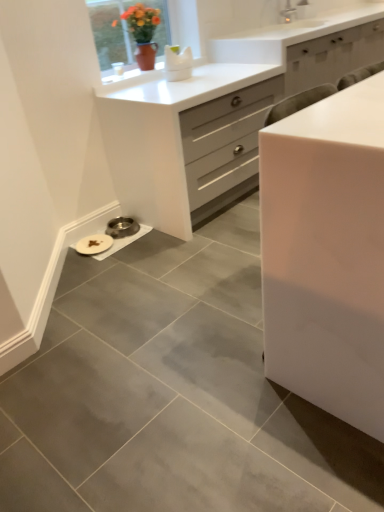
What do you see at coordinates (131, 34) in the screenshot? I see `matte ceramic vase at upper center` at bounding box center [131, 34].

The image size is (384, 512). I want to click on white glossy chest of drawers at center, placed as the second chest of drawers when sorted from front to back, so click(x=161, y=137).

Measure the distance between point (376, 95) and camera.

Point (376, 95) is 4.06 feet away from camera.

Where is `matte ceramic vase at upper center`? matte ceramic vase at upper center is located at coordinates (131, 34).

Which object is positioned more to the left, white glossy cabinet at center, marked as the first chest of drawers in a front-to-back arrangement, or white glossy chest of drawers at center, placed as the second chest of drawers when sorted from front to back?

From the viewer's perspective, white glossy chest of drawers at center, placed as the second chest of drawers when sorted from front to back, appears more on the left side.

At what (x,y) coordinates should I click in order to perform the action: click on chest of drawers above the white glossy chest of drawers at center, the first chest of drawers when ordered from back to front (from a real-world perspective). Please return your answer as a coordinate pair (x, y). Looking at the image, I should click on (326, 253).

How many degrees apart are the facing directions of white glossy cabinet at center, which is counted as the 2th chest of drawers, starting from the back, and white glossy chest of drawers at center, placed as the second chest of drawers when sorted from front to back?

0.415 degrees.

Is white glossy cabinet at center, marked as the first chest of drawers in a front-to-back arrangement, closer to camera compared to white glossy chest of drawers at center, placed as the second chest of drawers when sorted from front to back?

Yes, it is.

Does point (136, 113) come farther from viewer compared to point (97, 17)?

No.

How many degrees apart are the facing directions of white glossy chest of drawers at center, the first chest of drawers when ordered from back to front, and matte ceramic vase at upper center?

There is a 0.83-degree angle between the facing directions of white glossy chest of drawers at center, the first chest of drawers when ordered from back to front, and matte ceramic vase at upper center.

You are a GUI agent. You are given a task and a screenshot of the screen. Output one action in this format:
    pyautogui.click(x=<x>, y=<y>)
    Task: Click on the 1st chest of drawers in front of the matte ceramic vase at upper center
    This screenshot has width=384, height=512.
    Given the screenshot: What is the action you would take?
    tap(161, 137)

Are white glossy chest of drawers at center, placed as the second chest of drawers when sorted from front to back, and matte ceramic vase at upper center located far from each other?

white glossy chest of drawers at center, placed as the second chest of drawers when sorted from front to back, is near matte ceramic vase at upper center, not far away.

Between white glossy chest of drawers at center, placed as the second chest of drawers when sorted from front to back, and white glossy cabinet at center, which is counted as the 2th chest of drawers, starting from the back, which one appears on the left side from the viewer's perspective?

Positioned to the left is white glossy chest of drawers at center, placed as the second chest of drawers when sorted from front to back.

Looking at this image, from the image's perspective, between white glossy chest of drawers at center, the first chest of drawers when ordered from back to front, and white glossy cabinet at center, which is counted as the 2th chest of drawers, starting from the back, which one is located above?

white glossy chest of drawers at center, the first chest of drawers when ordered from back to front, from the image's perspective.

Locate an element on the screen. This screenshot has height=512, width=384. chest of drawers below the white glossy cabinet at center, marked as the first chest of drawers in a front-to-back arrangement (from a real-world perspective) is located at coordinates point(161,137).

Is white glossy chest of drawers at center, placed as the second chest of drawers when sorted from front to back, in front of or behind white glossy cabinet at center, marked as the first chest of drawers in a front-to-back arrangement, in the image?

white glossy chest of drawers at center, placed as the second chest of drawers when sorted from front to back, is positioned farther from the viewer than white glossy cabinet at center, marked as the first chest of drawers in a front-to-back arrangement.

Is white glossy cabinet at center, marked as the first chest of drawers in a front-to-back arrangement, surrounding matte ceramic vase at upper center?

That's incorrect, matte ceramic vase at upper center is not inside white glossy cabinet at center, marked as the first chest of drawers in a front-to-back arrangement.

From the image's perspective, would you say white glossy cabinet at center, marked as the first chest of drawers in a front-to-back arrangement, is shown under matte ceramic vase at upper center?

Yes, from the image's perspective, white glossy cabinet at center, marked as the first chest of drawers in a front-to-back arrangement, is below matte ceramic vase at upper center.

Considering the positions of objects white glossy cabinet at center, marked as the first chest of drawers in a front-to-back arrangement, and matte ceramic vase at upper center in the image provided, who is more to the left, white glossy cabinet at center, marked as the first chest of drawers in a front-to-back arrangement, or matte ceramic vase at upper center?

matte ceramic vase at upper center.

Which is closer to the camera, [300,275] or [180,4]?

The point [300,275] is in front.

In the image, is matte ceramic vase at upper center positioned in front of or behind white glossy chest of drawers at center, placed as the second chest of drawers when sorted from front to back?

Clearly, matte ceramic vase at upper center is behind white glossy chest of drawers at center, placed as the second chest of drawers when sorted from front to back.

Does matte ceramic vase at upper center have a lesser height compared to white glossy chest of drawers at center, placed as the second chest of drawers when sorted from front to back?

Indeed, matte ceramic vase at upper center has a lesser height compared to white glossy chest of drawers at center, placed as the second chest of drawers when sorted from front to back.

Is matte ceramic vase at upper center looking in the opposite direction of white glossy chest of drawers at center, placed as the second chest of drawers when sorted from front to back?

matte ceramic vase at upper center does not have its back to white glossy chest of drawers at center, placed as the second chest of drawers when sorted from front to back.

Based on the photo, from a real-world perspective, does matte ceramic vase at upper center stand above white glossy cabinet at center, which is counted as the 2th chest of drawers, starting from the back?

Yes, from a real-world perspective, matte ceramic vase at upper center is on top of white glossy cabinet at center, which is counted as the 2th chest of drawers, starting from the back.

How distant is matte ceramic vase at upper center from white glossy cabinet at center, which is counted as the 2th chest of drawers, starting from the back?

matte ceramic vase at upper center and white glossy cabinet at center, which is counted as the 2th chest of drawers, starting from the back, are 1.98 meters apart.

Is matte ceramic vase at upper center thinner than white glossy cabinet at center, marked as the first chest of drawers in a front-to-back arrangement?

Incorrect, the width of matte ceramic vase at upper center is not less than that of white glossy cabinet at center, marked as the first chest of drawers in a front-to-back arrangement.

Does point (123, 53) come closer to viewer compared to point (373, 424)?

No, (123, 53) is behind (373, 424).

Where is `chest of drawers on the right side of white glossy chest of drawers at center, placed as the second chest of drawers when sorted from front to back`? Image resolution: width=384 pixels, height=512 pixels. chest of drawers on the right side of white glossy chest of drawers at center, placed as the second chest of drawers when sorted from front to back is located at coordinates (326, 253).

You are a GUI agent. You are given a task and a screenshot of the screen. Output one action in this format:
    pyautogui.click(x=<x>, y=<y>)
    Task: Click on the 2nd chest of drawers located beneath the matte ceramic vase at upper center (from a real-world perspective)
    This screenshot has height=512, width=384.
    Given the screenshot: What is the action you would take?
    pyautogui.click(x=161, y=137)

Estimate the real-world distances between objects in this image. Which object is closer to matte ceramic vase at upper center, white glossy cabinet at center, which is counted as the 2th chest of drawers, starting from the back, or white glossy chest of drawers at center, placed as the second chest of drawers when sorted from front to back?

white glossy chest of drawers at center, placed as the second chest of drawers when sorted from front to back, is positioned closer to the anchor matte ceramic vase at upper center.

Based on their spatial positions, is white glossy chest of drawers at center, placed as the second chest of drawers when sorted from front to back, or matte ceramic vase at upper center closer to white glossy cabinet at center, marked as the first chest of drawers in a front-to-back arrangement?

white glossy chest of drawers at center, placed as the second chest of drawers when sorted from front to back, is positioned closer to the anchor white glossy cabinet at center, marked as the first chest of drawers in a front-to-back arrangement.

When comparing their distances from white glossy chest of drawers at center, the first chest of drawers when ordered from back to front, does white glossy cabinet at center, which is counted as the 2th chest of drawers, starting from the back, or matte ceramic vase at upper center seem further?

white glossy cabinet at center, which is counted as the 2th chest of drawers, starting from the back, lies further to white glossy chest of drawers at center, the first chest of drawers when ordered from back to front, than the other object.

Estimate the real-world distances between objects in this image. Which object is closer to white glossy cabinet at center, marked as the first chest of drawers in a front-to-back arrangement, matte ceramic vase at upper center or white glossy chest of drawers at center, the first chest of drawers when ordered from back to front?

The object closer to white glossy cabinet at center, marked as the first chest of drawers in a front-to-back arrangement, is white glossy chest of drawers at center, the first chest of drawers when ordered from back to front.

Based on their spatial positions, is white glossy chest of drawers at center, the first chest of drawers when ordered from back to front, or white glossy cabinet at center, which is counted as the 2th chest of drawers, starting from the back, closer to matte ceramic vase at upper center?

Based on the image, white glossy chest of drawers at center, the first chest of drawers when ordered from back to front, appears to be nearer to matte ceramic vase at upper center.

Based on their spatial positions, is matte ceramic vase at upper center or white glossy cabinet at center, which is counted as the 2th chest of drawers, starting from the back, closer to white glossy chest of drawers at center, placed as the second chest of drawers when sorted from front to back?

The object closer to white glossy chest of drawers at center, placed as the second chest of drawers when sorted from front to back, is matte ceramic vase at upper center.

This screenshot has height=512, width=384. I want to click on the chest of drawers located between white glossy cabinet at center, marked as the first chest of drawers in a front-to-back arrangement, and matte ceramic vase at upper center in the depth direction, so click(161, 137).